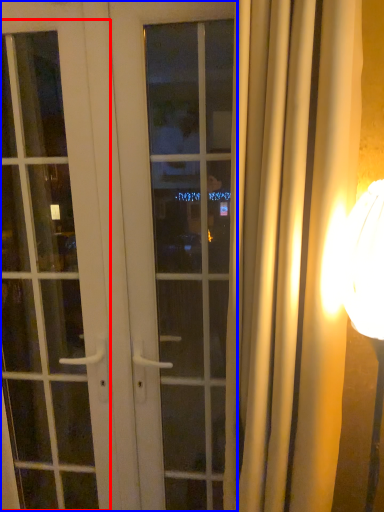
Question: Which of the following is the closest to the observer, screen door (highlighted by a red box) or door (highlighted by a blue box)?

Choices:
 (A) screen door
 (B) door

Answer: (B)